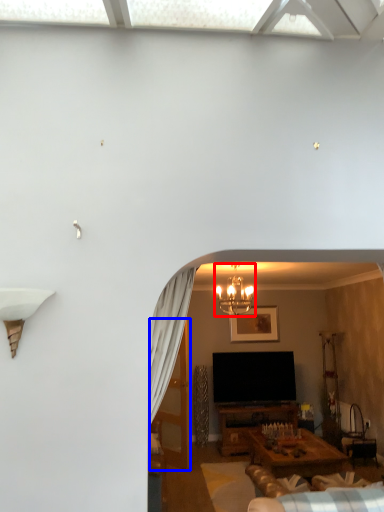
Question: Among these objects, which one is nearest to the camera, light fixture (highlighted by a red box) or glass door (highlighted by a blue box)?

Choices:
 (A) light fixture
 (B) glass door

Answer: (A)